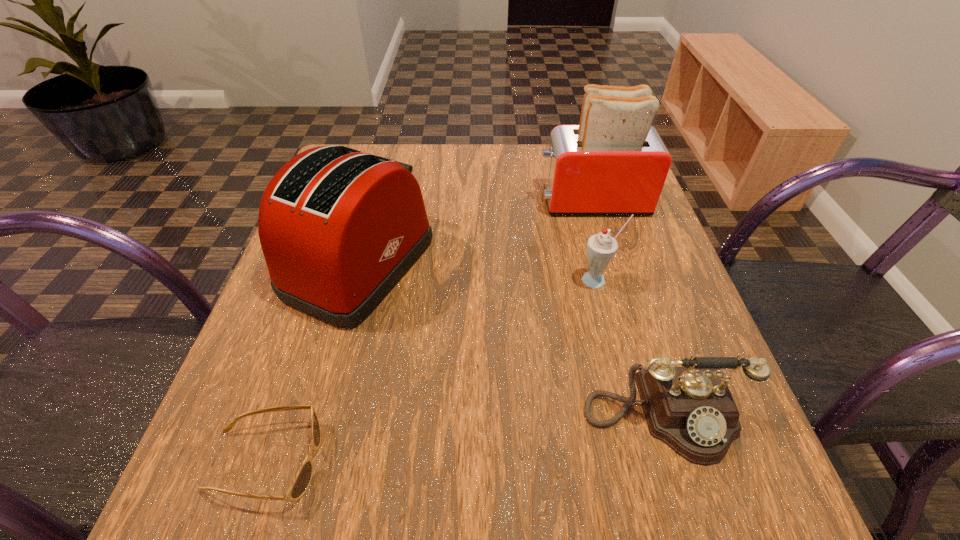
Identify the location of the right toaster. (614, 162).

Find the location of a particular element. This screenshot has height=540, width=960. the left toaster is located at coordinates (339, 228).

You are a GUI agent. You are given a task and a screenshot of the screen. Output one action in this format:
    pyautogui.click(x=<x>, y=<y>)
    Task: Click on the milkshake
    
    Given the screenshot: What is the action you would take?
    pyautogui.click(x=601, y=248)

You are a GUI agent. You are given a task and a screenshot of the screen. Output one action in this format:
    pyautogui.click(x=<x>, y=<y>)
    Task: Click on the telephone
    This screenshot has width=960, height=540.
    Given the screenshot: What is the action you would take?
    pyautogui.click(x=690, y=409)

The image size is (960, 540). I want to click on the shortest object, so click(301, 482).

Locate an element on the screen. vacant area situated on the front-facing side of the right toaster is located at coordinates (382, 201).

You are a GUI agent. You are given a task and a screenshot of the screen. Output one action in this format:
    pyautogui.click(x=<x>, y=<y>)
    Task: Click on the free space located 0.070m on the front-facing side of the right toaster
    
    Given the screenshot: What is the action you would take?
    pyautogui.click(x=507, y=201)

Image resolution: width=960 pixels, height=540 pixels. Find the location of `free region located 0.220m on the front-facing side of the right toaster`. free region located 0.220m on the front-facing side of the right toaster is located at coordinates (443, 201).

The image size is (960, 540). What are the coordinates of `free region located on the right of the left toaster` in the screenshot? It's located at (481, 265).

The image size is (960, 540). Find the location of `free location located 0.200m on the straw side of the milkshake`. free location located 0.200m on the straw side of the milkshake is located at coordinates (625, 385).